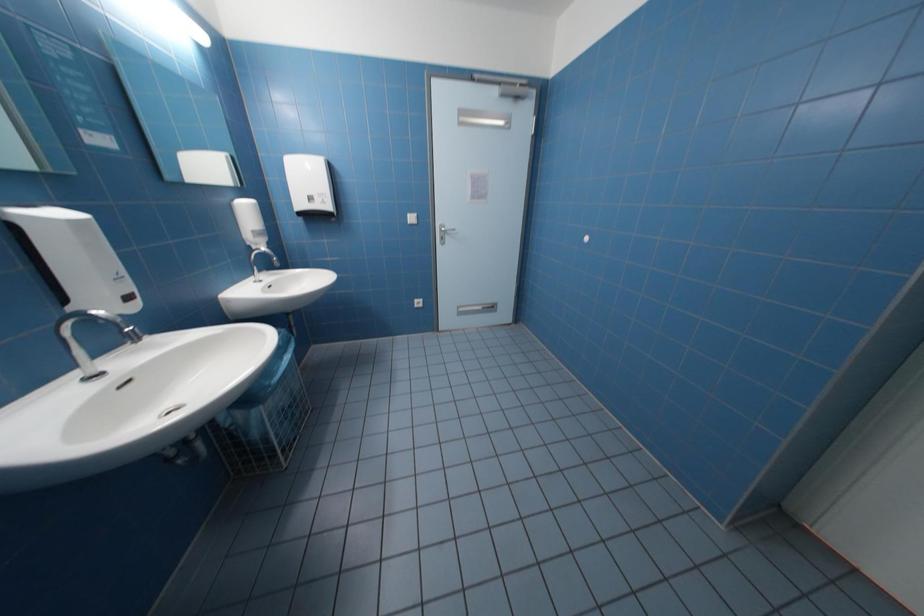
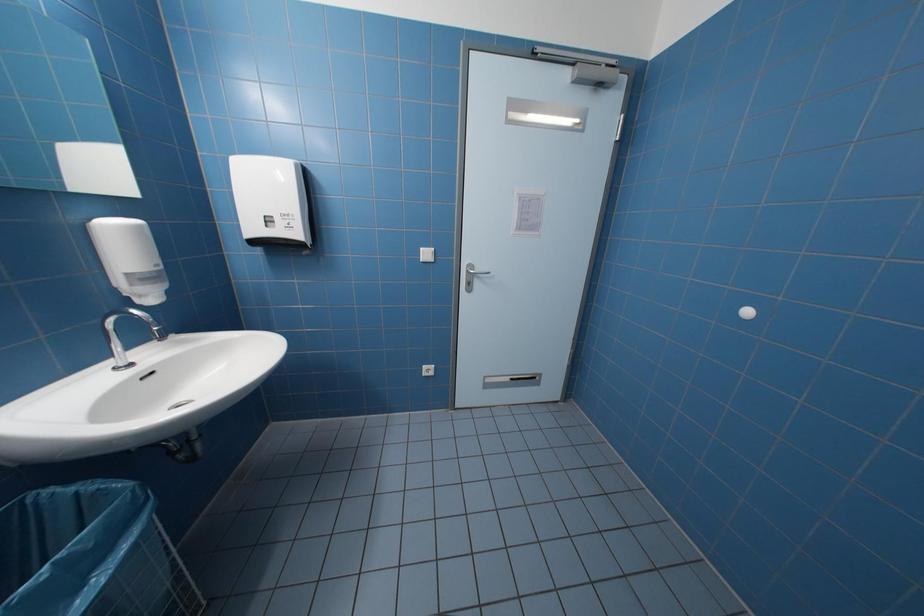
Question: The images are taken continuously from a first-person perspective. In which direction is your viewpoint rotating?

Choices:
 (A) Left
 (B) Right
 (C) Up
 (D) Down

Answer: (C)